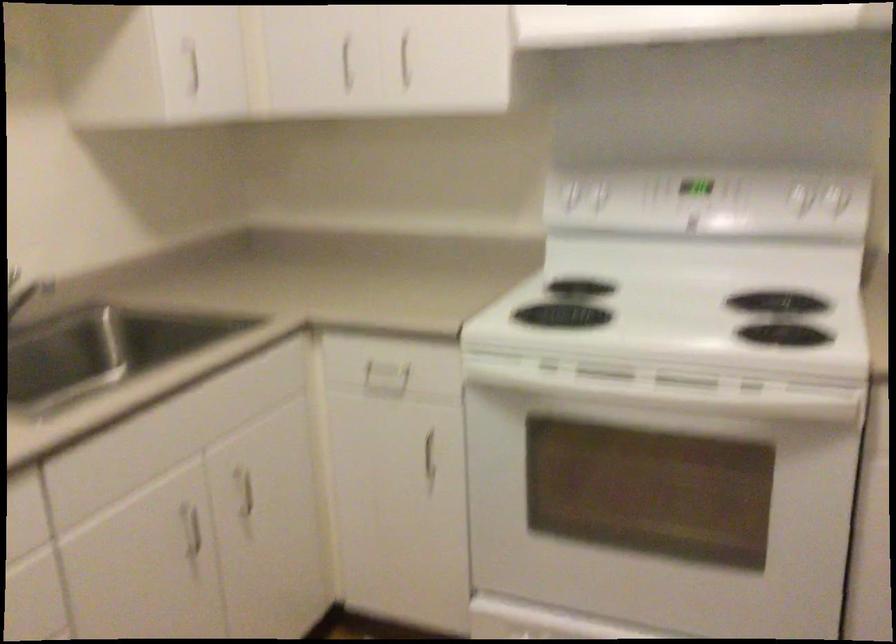
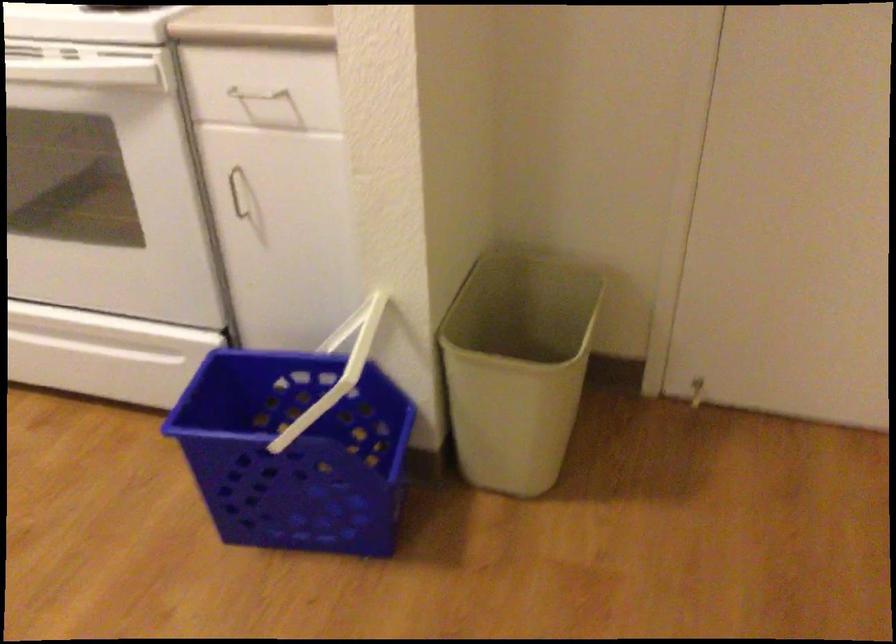
The point at (737,500) is marked in the first image. Where is the corresponding point in the second image?

(104, 185)